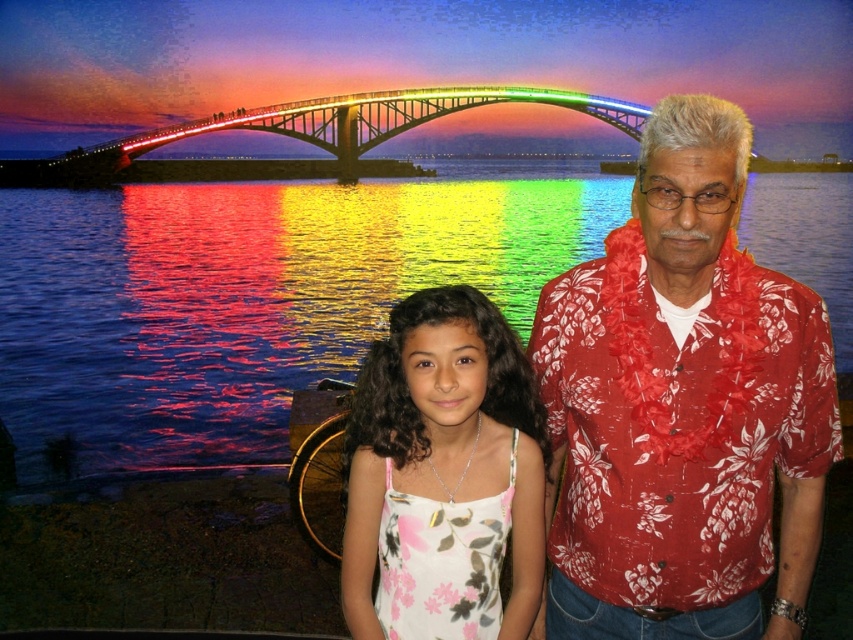
Question: Estimate the real-world distances between objects in this image. Which object is farther from the glossy water at center?

Choices:
 (A) white floral dress at center
 (B) red floral shirt at right

Answer: (B)

Question: From the image, what is the correct spatial relationship of red floral shirt at right in relation to white floral dress at center?

Choices:
 (A) left
 (B) right

Answer: (B)

Question: Which point is closer to the camera?

Choices:
 (A) white floral dress at center
 (B) glossy water at center
 (C) red floral shirt at right

Answer: (C)

Question: Which of the following is the farthest from the observer?

Choices:
 (A) (712, 250)
 (B) (434, 289)

Answer: (B)

Question: Does glossy water at center appear on the left side of red floral shirt at right?

Choices:
 (A) yes
 (B) no

Answer: (A)

Question: Does glossy water at center lie behind red floral shirt at right?

Choices:
 (A) yes
 (B) no

Answer: (A)